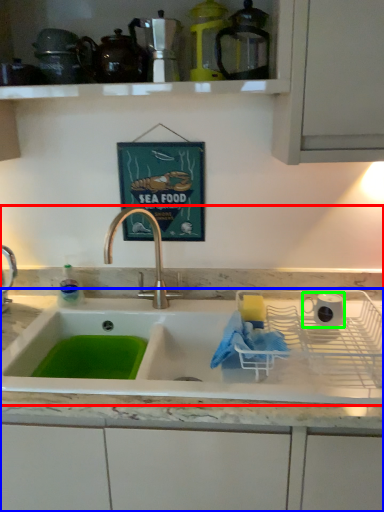
Question: Which is farther away from sink (highlighted by a red box)? countertop (highlighted by a blue box) or appliance (highlighted by a green box)?

Choices:
 (A) countertop
 (B) appliance

Answer: (B)